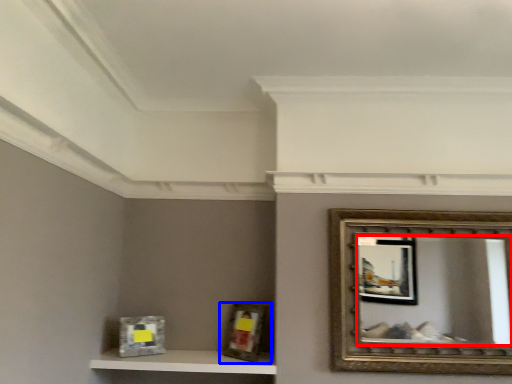
Question: Among these objects, which one is nearest to the camera, mirror (highlighted by a red box) or picture frame (highlighted by a blue box)?

Choices:
 (A) mirror
 (B) picture frame

Answer: (A)